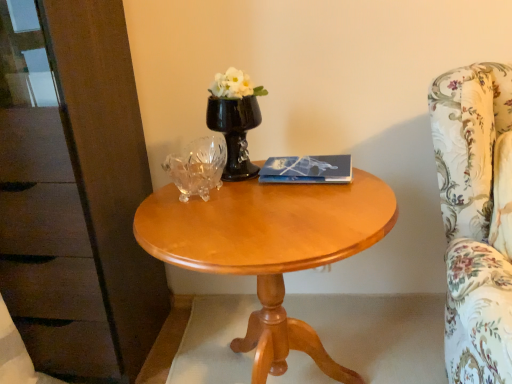
The height and width of the screenshot is (384, 512). In order to click on free space on the front side of blue glossy book at center in this screenshot , I will do `click(308, 203)`.